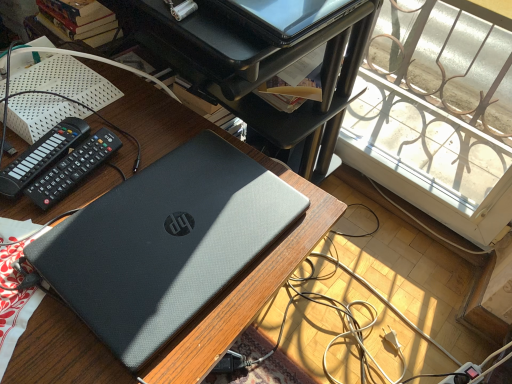
Identify the location of vacant space behind black plastic remote at upper left, the 2th control when ordered from left to right. The height and width of the screenshot is (384, 512). (126, 115).